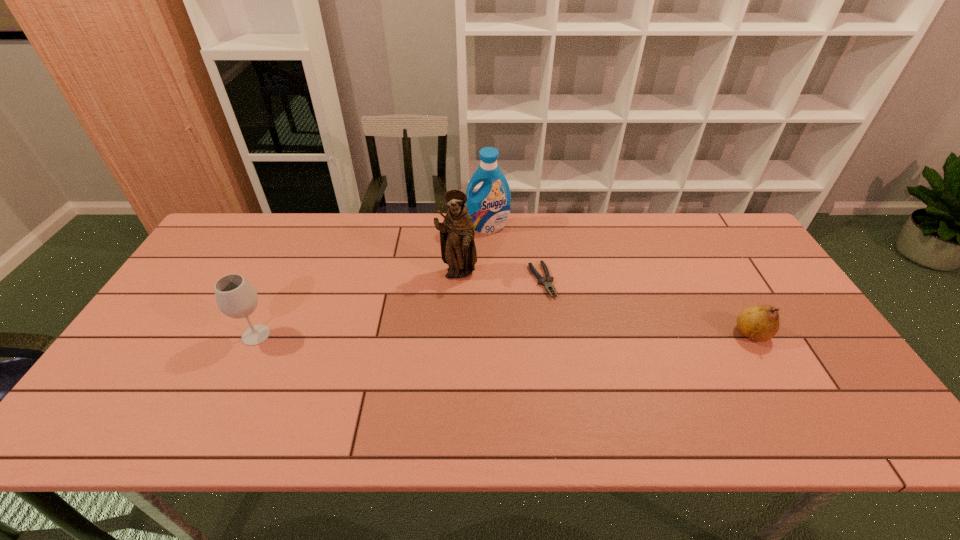
Find the location of a particular element. vacant space located on the front-facing side of the detergent is located at coordinates (487, 245).

The height and width of the screenshot is (540, 960). What are the coordinates of `free space located on the front-facing side of the detergent` in the screenshot? It's located at (486, 255).

The width and height of the screenshot is (960, 540). I want to click on vacant point located 0.070m on the front-facing side of the detergent, so click(x=487, y=247).

Where is `vacant space positioned 0.150m on the front-facing side of the figurine`? The height and width of the screenshot is (540, 960). vacant space positioned 0.150m on the front-facing side of the figurine is located at coordinates (471, 323).

Where is `vacant space located on the front-facing side of the figurine`? vacant space located on the front-facing side of the figurine is located at coordinates (470, 318).

This screenshot has height=540, width=960. Find the location of `free space located 0.070m on the front-facing side of the figurine`. free space located 0.070m on the front-facing side of the figurine is located at coordinates (466, 302).

You are a GUI agent. You are given a task and a screenshot of the screen. Output one action in this format:
    pyautogui.click(x=<x>, y=<y>)
    Task: Click on the free space located at the gripping part of the shortest object
    
    Given the screenshot: What is the action you would take?
    pyautogui.click(x=573, y=348)

Where is `free region located at the gripping part of the shortest object`? The width and height of the screenshot is (960, 540). free region located at the gripping part of the shortest object is located at coordinates (602, 401).

Identify the location of vacant space located 0.070m at the gripping part of the shortest object. This screenshot has width=960, height=540. (557, 317).

This screenshot has width=960, height=540. What are the coordinates of `object positioned at the far edge` in the screenshot? It's located at coord(489,207).